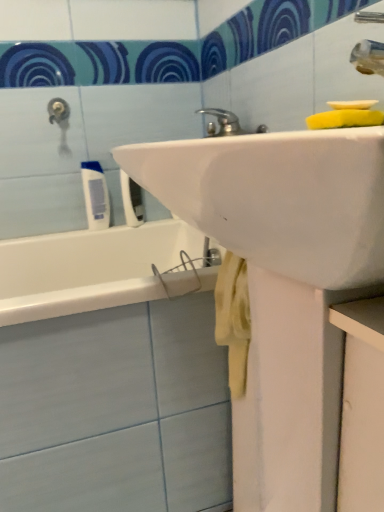
Question: Is white matte tube at left, placed as the second toiletry when sorted from right to left, in front of or behind yellow sponge at upper right in the image?

Choices:
 (A) front
 (B) behind

Answer: (B)

Question: From a real-world perspective, is white matte tube at left, positioned as the first toiletry in left-to-right order, physically located above or below yellow sponge at upper right?

Choices:
 (A) below
 (B) above

Answer: (A)

Question: Which is nearer to the white plastic toothbrush at upper left, which is the 1th toiletry in right-to-left order?

Choices:
 (A) yellow sponge at upper right
 (B) white matte tube at left, placed as the second toiletry when sorted from right to left

Answer: (B)

Question: Estimate the real-world distances between objects in this image. Which object is closer to the white matte tube at left, positioned as the first toiletry in left-to-right order?

Choices:
 (A) white plastic toothbrush at upper left, which is the 1th toiletry in right-to-left order
 (B) yellow sponge at upper right

Answer: (A)